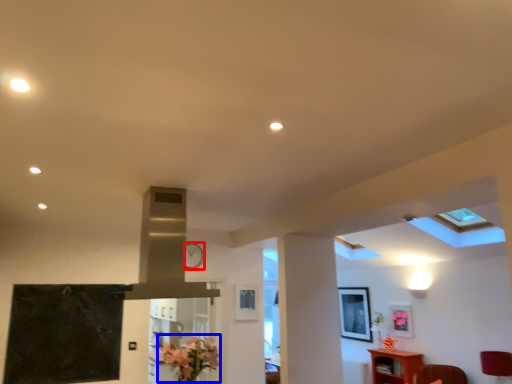
Question: Which point is further to the camera, clock (highlighted by a red box) or flower (highlighted by a blue box)?

Choices:
 (A) clock
 (B) flower

Answer: (A)